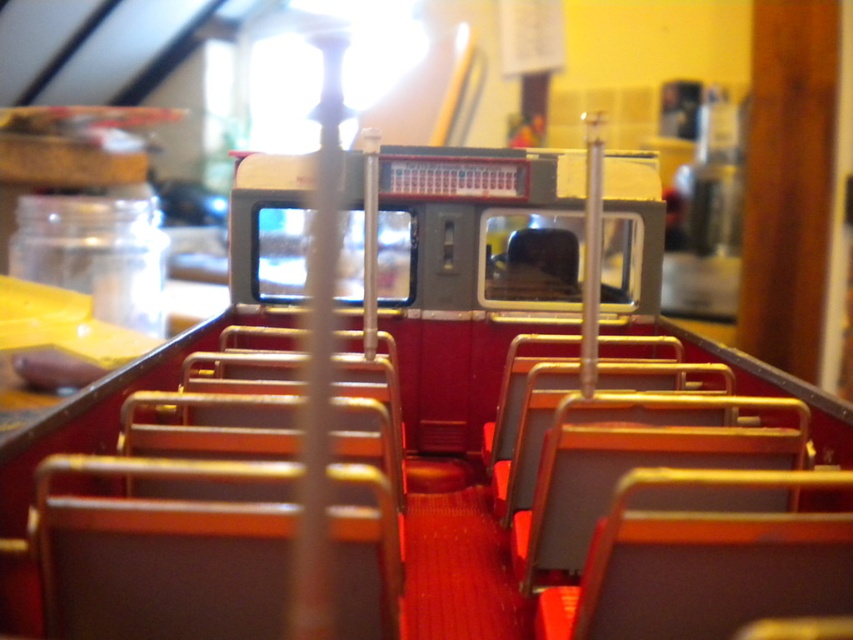
Who is lower down, brown leather seat at center or metallic red chair at center?

brown leather seat at center

Is brown leather seat at center positioned at the back of metallic red chair at center?

No, brown leather seat at center is in front of metallic red chair at center.

Locate an element on the screen. The width and height of the screenshot is (853, 640). brown leather seat at center is located at coordinates (637, 461).

Locate an element on the screen. The image size is (853, 640). brown leather seat at center is located at coordinates (637, 461).

Does brown leather seat at center have a greater width compared to metallic gold chair at center?

Yes, brown leather seat at center is wider than metallic gold chair at center.

Looking at this image, is brown leather seat at center bigger than metallic gold chair at center?

Correct, brown leather seat at center is larger in size than metallic gold chair at center.

Where is `brown leather seat at center`? brown leather seat at center is located at coordinates coord(637,461).

Does matte brown chair at center have a greater height compared to metallic gray seat at center?

In fact, matte brown chair at center may be shorter than metallic gray seat at center.

Who is more forward, (x=57, y=500) or (x=686, y=380)?

Positioned in front is point (x=57, y=500).

The image size is (853, 640). I want to click on matte brown chair at center, so click(x=163, y=552).